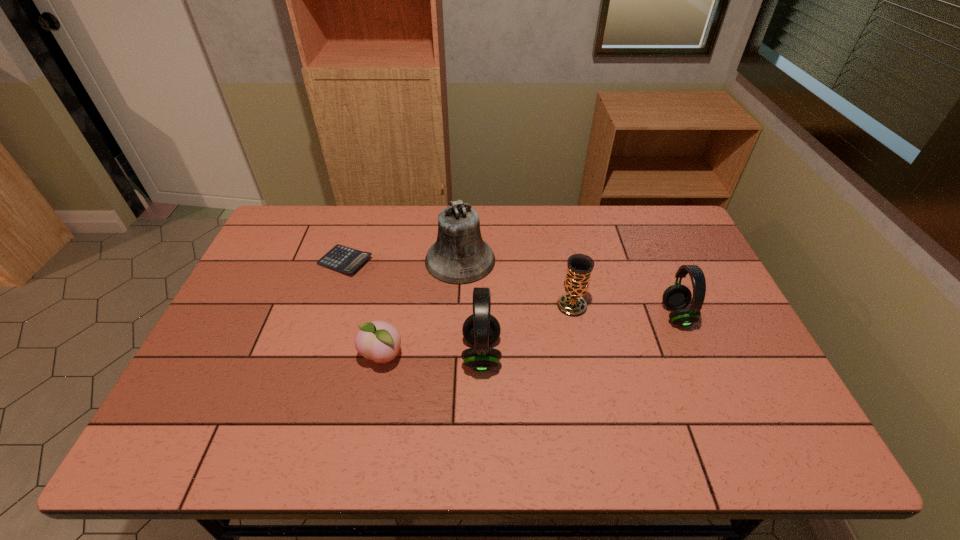
In the image, there is a desktop. Identify the location of vacant space at the near edge. (285, 408).

This screenshot has width=960, height=540. I want to click on free location at the left edge, so click(x=226, y=333).

In the image, there is a desktop. At what (x,y) coordinates should I click in order to perform the action: click on vacant space at the far left corner. Please return your answer as a coordinate pair (x, y). This screenshot has width=960, height=540. Looking at the image, I should click on (307, 235).

Identify the location of unoccupied position between the rightmost object and the calculator. (511, 288).

I want to click on free area in between the left headset and the shortest object, so click(x=414, y=308).

Identify the location of free spot between the peach and the calculator. tap(364, 309).

I want to click on free space between the fifth object from left to right and the left headset, so click(x=527, y=330).

The image size is (960, 540). I want to click on empty space between the shorter headset and the chalice, so click(624, 310).

You are a GUI agent. You are given a task and a screenshot of the screen. Output one action in this format:
    pyautogui.click(x=<x>, y=<y>)
    Task: Click on the vacant area that lies between the shorter headset and the taller headset
    
    Given the screenshot: What is the action you would take?
    pyautogui.click(x=579, y=335)

The height and width of the screenshot is (540, 960). In order to click on empty location between the calculator and the left headset in this screenshot , I will do `click(414, 308)`.